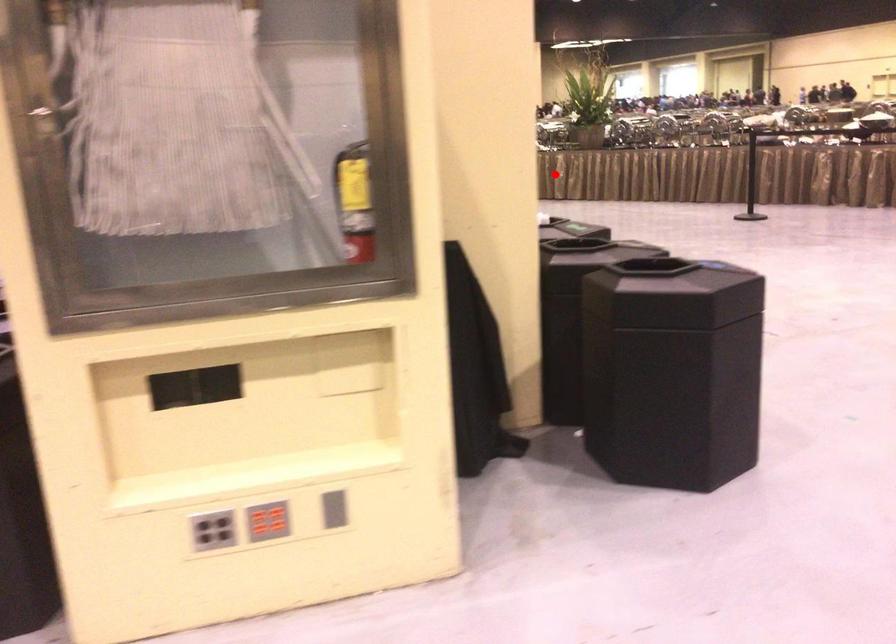
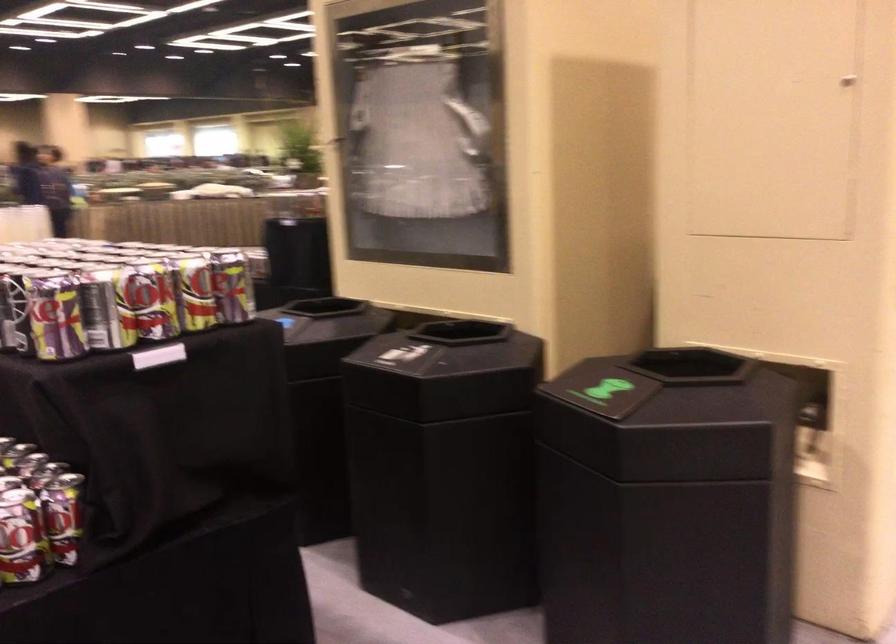
Question: I am providing you with two images of the same scene from different viewpoints. A red point is marked on the first image. Can you still see the location of the red point in image 2?

Choices:
 (A) Yes
 (B) No

Answer: (B)